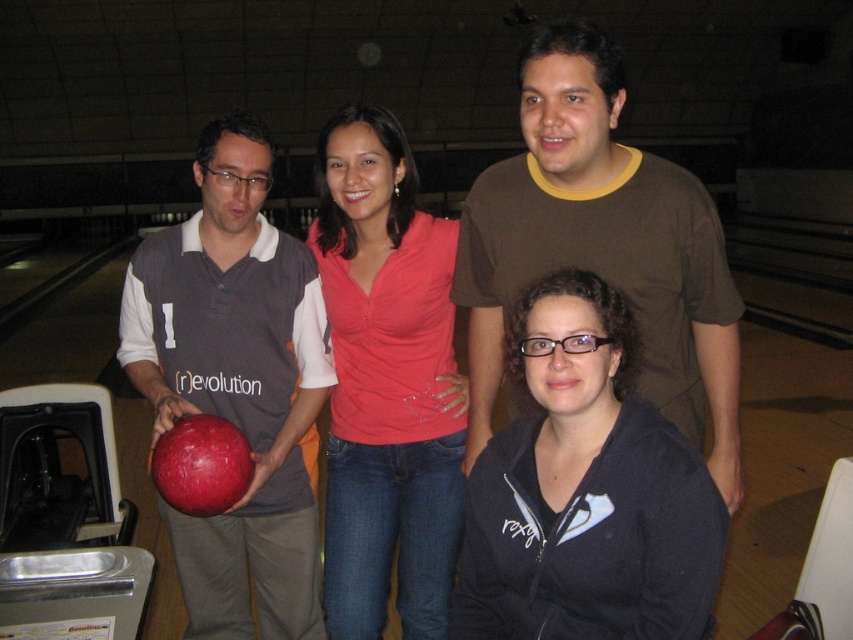
Is point (656, 609) positioned behind point (425, 275)?

No, it is not.

Is black matte jacket at lower right taller than matte pink shirt at center?

Incorrect, black matte jacket at lower right's height is not larger of matte pink shirt at center's.

Is point (514, 497) positioned in front of point (367, 474)?

Yes, point (514, 497) is in front of point (367, 474).

Find the location of a particular element. black matte jacket at lower right is located at coordinates (585, 490).

Does brown cotton t-shirt at upper center appear on the right side of matte pink shirt at center?

Indeed, brown cotton t-shirt at upper center is positioned on the right side of matte pink shirt at center.

Is point (529, 179) positioned behind point (338, 195)?

No.

Is point (573, 88) closer to camera compared to point (340, 140)?

Yes.

The height and width of the screenshot is (640, 853). I want to click on brown cotton t-shirt at upper center, so click(602, 244).

The image size is (853, 640). Describe the element at coordinates (236, 385) in the screenshot. I see `matte gray shirt at center` at that location.

The image size is (853, 640). What do you see at coordinates (236, 385) in the screenshot?
I see `matte gray shirt at center` at bounding box center [236, 385].

Identify the location of matte gray shirt at center. The image size is (853, 640). (236, 385).